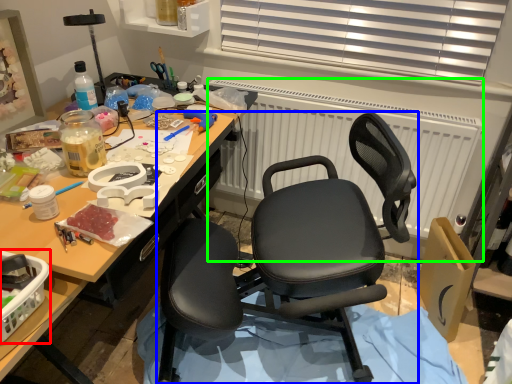
Question: Which object is positioned closest to box (highlighted by a red box)? Select from chair (highlighted by a blue box) and radiator (highlighted by a green box).

Choices:
 (A) chair
 (B) radiator

Answer: (A)